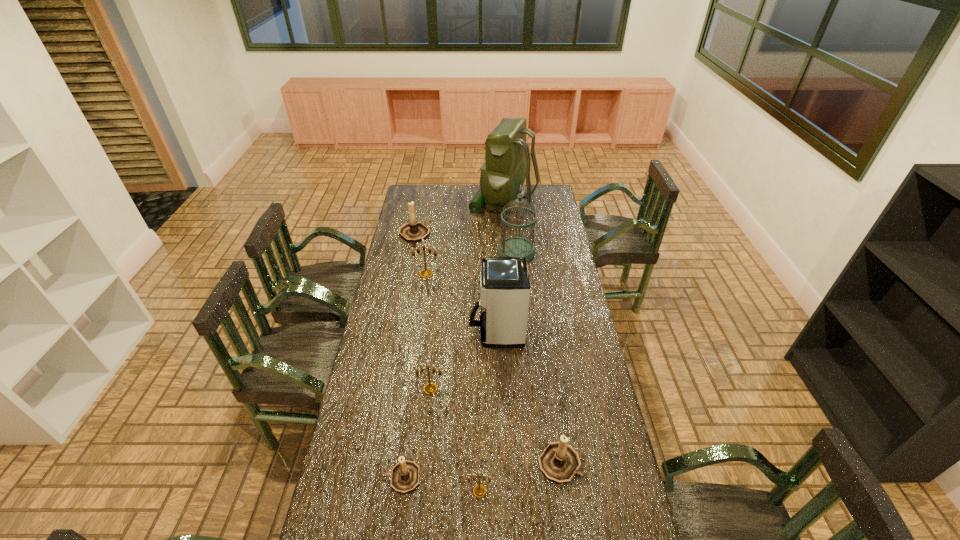
This screenshot has height=540, width=960. What are the coordinates of `the third closest gold candelabrum relative to the birdcage` in the screenshot? It's located at (479, 490).

Locate which gold candelabrum is the closest to the fifth candelabrum from left to right. Please provide its 2D coordinates. Your answer should be formatted as a tuple, i.e. [(x, y)], where the tuple contains the x and y coordinates of a point satisfying the conditions above.

[(430, 388)]

Identify the location of free location that satisfies the following two spatial constraints: 1. on the front-facing side of the birdcage; 2. on the front side of the smallest brown candle holder. (540, 477).

You are a GUI agent. You are given a task and a screenshot of the screen. Output one action in this format:
    pyautogui.click(x=<x>, y=<y>)
    Task: Click on the vacant space that satisfies the following two spatial constraints: 1. on the front of the green backpack with visible pockets; 2. on the front side of the fifth candelabrum from left to right
    Image resolution: width=960 pixels, height=540 pixels.
    Given the screenshot: What is the action you would take?
    pyautogui.click(x=525, y=491)